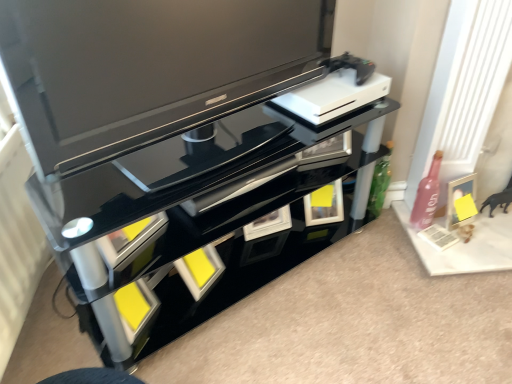
What do you see at coordinates (145, 69) in the screenshot? This screenshot has width=512, height=384. I see `matte black tv at upper center` at bounding box center [145, 69].

In order to click on matte silver picture frame at right in this screenshot , I will do `click(459, 198)`.

Image resolution: width=512 pixels, height=384 pixels. I want to click on matte black tv at upper center, so click(145, 69).

Is point (418, 201) farther from camera compared to point (464, 182)?

That is True.

Is pink glass bottle at right completely or partially outside of matte silver picture frame at right?

That's correct, pink glass bottle at right is outside of matte silver picture frame at right.

Does pink glass bottle at right have a larger size compared to matte silver picture frame at right?

Yes, pink glass bottle at right is bigger than matte silver picture frame at right.

The image size is (512, 384). Identify the location of picture frame below the pink glass bottle at right (from a real-world perspective). (459, 198).

Based on their sizes in the image, would you say matte black tv at upper center is bigger or smaller than pink glass bottle at right?

Considering their sizes, matte black tv at upper center takes up more space than pink glass bottle at right.

Is matte black tv at upper center beside pink glass bottle at right?

They are not placed beside each other.

From a real-world perspective, is matte black tv at upper center over pink glass bottle at right?

Indeed, from a real-world perspective, matte black tv at upper center stands above pink glass bottle at right.

Based on the photo, looking at their sizes, would you say matte black tv at upper center is wider or thinner than pink glass bottle at right?

Considering their sizes, matte black tv at upper center looks broader than pink glass bottle at right.

Is matte silver picture frame at right not inside matte black tv at upper center?

matte silver picture frame at right is positioned outside matte black tv at upper center.

Considering the sizes of objects matte silver picture frame at right and matte black tv at upper center in the image provided, who is smaller, matte silver picture frame at right or matte black tv at upper center?

With smaller size is matte silver picture frame at right.

Find the location of a particular element. The width and height of the screenshot is (512, 384). television above the matte silver picture frame at right (from the image's perspective) is located at coordinates (145, 69).

How far apart are matte silver picture frame at right and matte black tv at upper center?

The distance of matte silver picture frame at right from matte black tv at upper center is 3.32 feet.

In the image, is pink glass bottle at right positioned in front of or behind matte black tv at upper center?

pink glass bottle at right is positioned farther from the viewer than matte black tv at upper center.

Which is further, (x=422, y=190) or (x=50, y=34)?

Point (x=422, y=190)

Which is more to the left, pink glass bottle at right or matte black tv at upper center?

From the viewer's perspective, matte black tv at upper center appears more on the left side.

Looking at the image, does pink glass bottle at right seem bigger or smaller compared to matte black tv at upper center?

Clearly, pink glass bottle at right is smaller in size than matte black tv at upper center.

Is matte silver picture frame at right to the left or to the right of pink glass bottle at right in the image?

Based on their positions, matte silver picture frame at right is located to the right of pink glass bottle at right.

Is pink glass bottle at right surrounded by matte silver picture frame at right?

No, matte silver picture frame at right does not contain pink glass bottle at right.

You are a GUI agent. You are given a task and a screenshot of the screen. Output one action in this format:
    pyautogui.click(x=<x>, y=<y>)
    Task: Click on the bottle above the matte silver picture frame at right (from a real-world perspective)
    Image resolution: width=512 pixels, height=384 pixels.
    Given the screenshot: What is the action you would take?
    pyautogui.click(x=426, y=196)

From the image's perspective, is matte silver picture frame at right located above or below pink glass bottle at right?

From the image's perspective, matte silver picture frame at right appears below pink glass bottle at right.

Between matte black tv at upper center and matte silver picture frame at right, which one appears on the left side from the viewer's perspective?

matte black tv at upper center.

You are a GUI agent. You are given a task and a screenshot of the screen. Output one action in this format:
    pyautogui.click(x=<x>, y=<y>)
    Task: Click on the picture frame below the matte black tv at upper center (from the image's perspective)
    The image size is (512, 384).
    Given the screenshot: What is the action you would take?
    pyautogui.click(x=459, y=198)

Is matte black tv at upper center turned away from matte silver picture frame at right?

No, matte silver picture frame at right is not at the back of matte black tv at upper center.

Which point is more distant from viewer, (56,39) or (465,192)?

The point (465,192) is behind.

Find the location of a particular element. The height and width of the screenshot is (384, 512). picture frame on the right of the pink glass bottle at right is located at coordinates (459, 198).

Where is `television above the pink glass bottle at right (from a real-world perspective)`? television above the pink glass bottle at right (from a real-world perspective) is located at coordinates (145, 69).

Based on their spatial positions, is pink glass bottle at right or matte black tv at upper center closer to matte silver picture frame at right?

pink glass bottle at right lies closer to matte silver picture frame at right than the other object.

Estimate the real-world distances between objects in this image. Which object is further from matte black tv at upper center, pink glass bottle at right or matte silver picture frame at right?

matte silver picture frame at right is positioned further to the anchor matte black tv at upper center.

Based on their spatial positions, is matte black tv at upper center or matte silver picture frame at right closer to pink glass bottle at right?

Based on the image, matte silver picture frame at right appears to be nearer to pink glass bottle at right.

Looking at the image, which one is located further to matte silver picture frame at right, matte black tv at upper center or pink glass bottle at right?

Among the two, matte black tv at upper center is located further to matte silver picture frame at right.

From the image, which object appears to be nearer to pink glass bottle at right, matte silver picture frame at right or matte black tv at upper center?

Among the two, matte silver picture frame at right is located nearer to pink glass bottle at right.

When comparing their distances from matte black tv at upper center, does matte silver picture frame at right or pink glass bottle at right seem closer?

Among the two, pink glass bottle at right is located nearer to matte black tv at upper center.

Image resolution: width=512 pixels, height=384 pixels. Identify the location of bottle between matte black tv at upper center and matte silver picture frame at right along the z-axis. (426, 196).